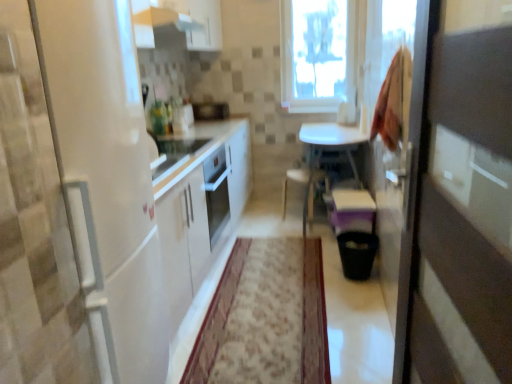
Question: From the image's perspective, is satin black microwave at center under carpet with floral pattern at center?

Choices:
 (A) no
 (B) yes

Answer: (A)

Question: Would you say satin black microwave at center contains carpet with floral pattern at center?

Choices:
 (A) yes
 (B) no

Answer: (B)

Question: Considering the relative sizes of satin black microwave at center and carpet with floral pattern at center in the image provided, is satin black microwave at center taller than carpet with floral pattern at center?

Choices:
 (A) no
 (B) yes

Answer: (B)

Question: Is satin black microwave at center closer to camera compared to carpet with floral pattern at center?

Choices:
 (A) yes
 (B) no

Answer: (B)

Question: Considering the relative sizes of satin black microwave at center and carpet with floral pattern at center in the image provided, is satin black microwave at center smaller than carpet with floral pattern at center?

Choices:
 (A) yes
 (B) no

Answer: (A)

Question: From a real-world perspective, is satin black microwave at center located beneath carpet with floral pattern at center?

Choices:
 (A) no
 (B) yes

Answer: (A)

Question: Is white glossy table at center turned away from satin black microwave at center?

Choices:
 (A) no
 (B) yes

Answer: (A)

Question: Does white glossy table at center have a smaller size compared to satin black microwave at center?

Choices:
 (A) no
 (B) yes

Answer: (A)

Question: Considering the relative sizes of white glossy table at center and satin black microwave at center in the image provided, is white glossy table at center shorter than satin black microwave at center?

Choices:
 (A) no
 (B) yes

Answer: (A)

Question: Is white glossy table at center completely or partially outside of satin black microwave at center?

Choices:
 (A) yes
 (B) no

Answer: (A)

Question: Considering the relative sizes of white glossy table at center and satin black microwave at center in the image provided, is white glossy table at center thinner than satin black microwave at center?

Choices:
 (A) yes
 (B) no

Answer: (B)

Question: Is white glossy table at center positioned in front of satin black microwave at center?

Choices:
 (A) yes
 (B) no

Answer: (A)

Question: Considering the relative sizes of white glossy table at center and white glossy exhaust hood at upper center in the image provided, is white glossy table at center wider than white glossy exhaust hood at upper center?

Choices:
 (A) no
 (B) yes

Answer: (B)